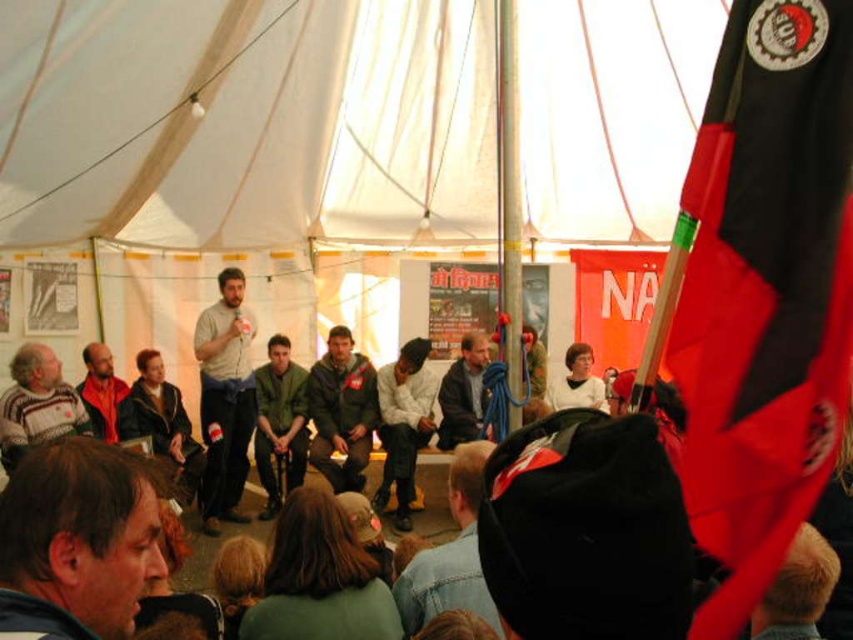
Question: Which point is closer to the camera?

Choices:
 (A) white matte shirt at center
 (B) blackflag at right
 (C) camouflage jacket at center

Answer: (B)

Question: Which point is closer to the camera?

Choices:
 (A) camouflage fabric jacket at center
 (B) white matte shirt at center
 (C) camouflage jacket at center
 (D) light gray fabric jacket at center

Answer: (B)

Question: Can you confirm if light gray cotton shirt at center is smaller than denim jacket at lower center?

Choices:
 (A) yes
 (B) no

Answer: (A)

Question: Can you confirm if brown hair at center is positioned to the right of matte red scarf at left?

Choices:
 (A) yes
 (B) no

Answer: (A)

Question: Which object is farther from the camera taking this photo?

Choices:
 (A) white canvas canopy at upper center
 (B) matte red scarf at left

Answer: (B)

Question: Is white canvas canopy at upper center below brown hair at center?

Choices:
 (A) no
 (B) yes

Answer: (A)